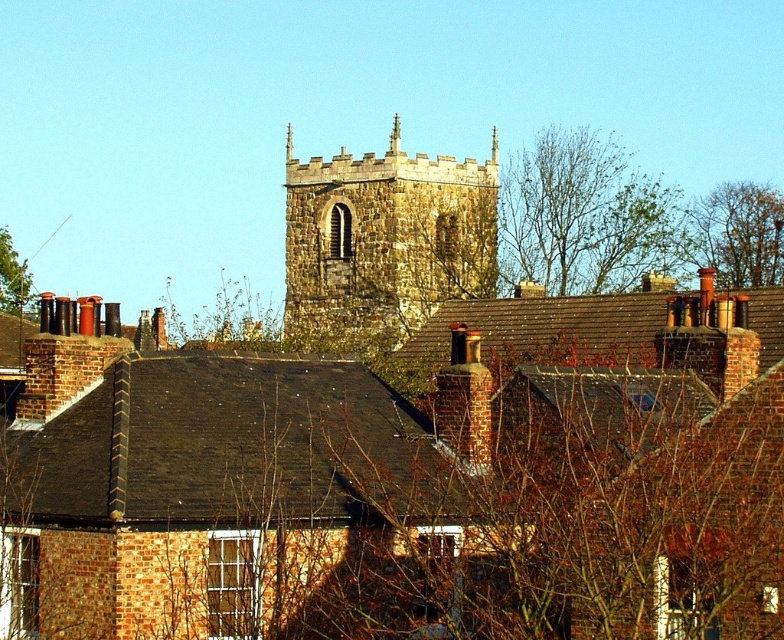
Between bare branches at upper center and green leafy tree at upper left, which one is positioned higher?

Positioned higher is bare branches at upper center.

Which of these two, bare branches at upper center or green leafy tree at upper left, stands shorter?

Standing shorter between the two is green leafy tree at upper left.

The height and width of the screenshot is (640, 784). In order to click on bare branches at upper center in this screenshot , I will do `click(583, 216)`.

How much distance is there between bare branches at upper center and brown leafy tree at upper right?

bare branches at upper center and brown leafy tree at upper right are 23.16 feet apart from each other.

Is bare branches at upper center smaller than brown leafy tree at upper right?

No, bare branches at upper center is not smaller than brown leafy tree at upper right.

What are the coordinates of `bare branches at upper center` in the screenshot? It's located at (583, 216).

The image size is (784, 640). Identify the location of bare branches at upper center. (583, 216).

Does stone steeple at center appear under green leafy tree at upper left?

Actually, stone steeple at center is above green leafy tree at upper left.

Does stone steeple at center appear over green leafy tree at upper left?

Correct, stone steeple at center is located above green leafy tree at upper left.

Image resolution: width=784 pixels, height=640 pixels. In order to click on stone steeple at center in this screenshot , I will do `click(383, 241)`.

This screenshot has height=640, width=784. What are the coordinates of `stone steeple at center` in the screenshot? It's located at (383, 241).